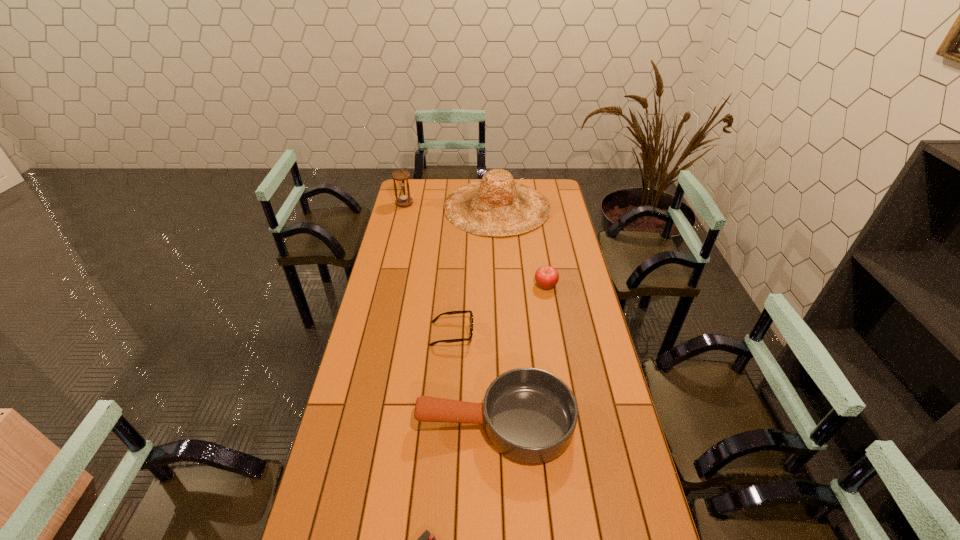
The height and width of the screenshot is (540, 960). What are the coordinates of `object identified as the closest to the sunhat` in the screenshot? It's located at (401, 176).